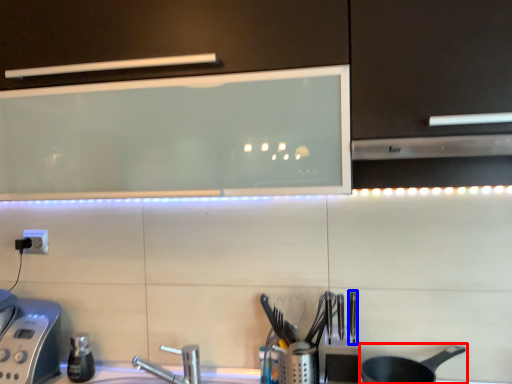
Question: Which point is further to the camera, frying pan (highlighted by a red box) or silverware (highlighted by a blue box)?

Choices:
 (A) frying pan
 (B) silverware

Answer: (B)